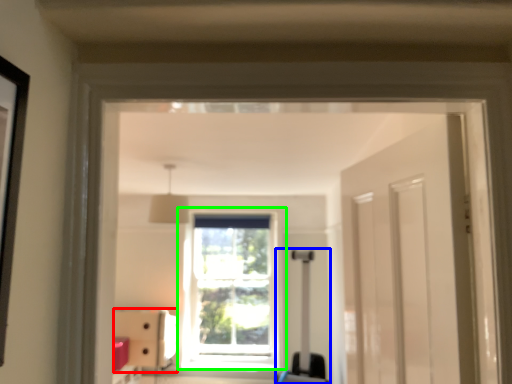
Question: Which object is positioned farthest from furniture (highlighted by a red box)? Select from luggage (highlighted by a blue box) and window (highlighted by a green box).

Choices:
 (A) luggage
 (B) window

Answer: (A)